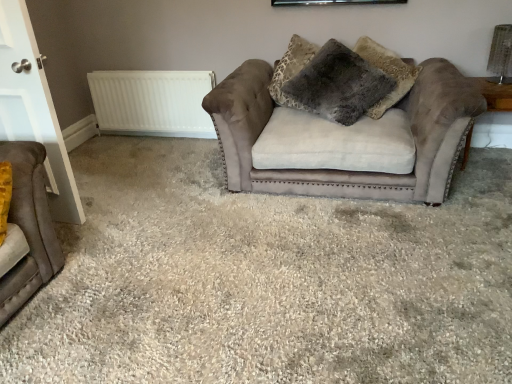
This screenshot has height=384, width=512. Identify the location of vacant space in front of white matte radiator at upper left. (163, 153).